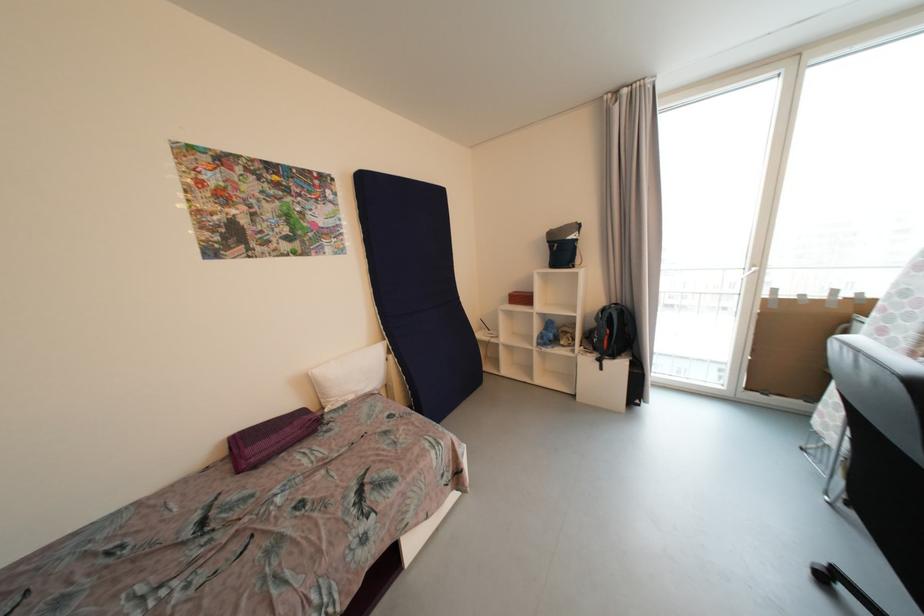
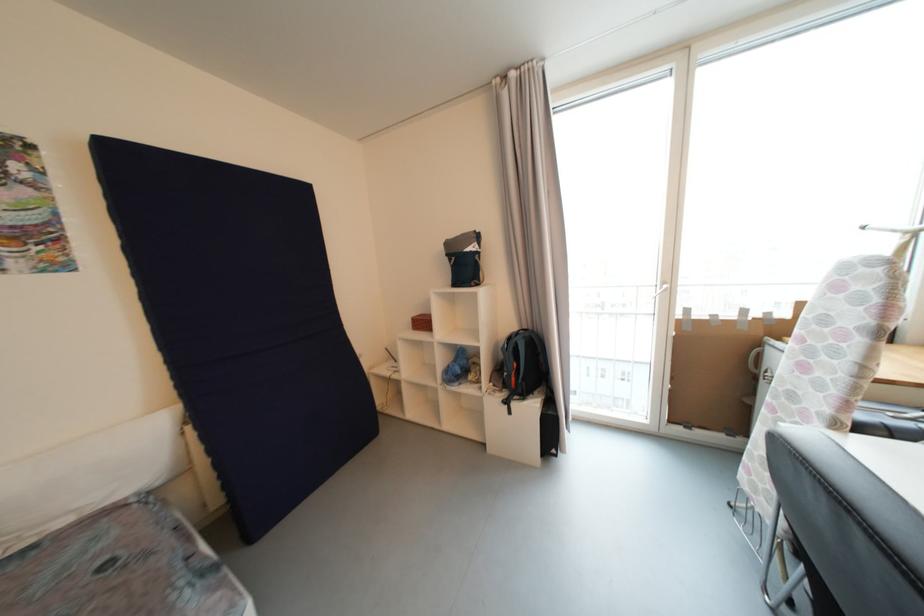
Which direction would the cameraman need to move to produce the second image?

The cameraman walked toward right, forward.